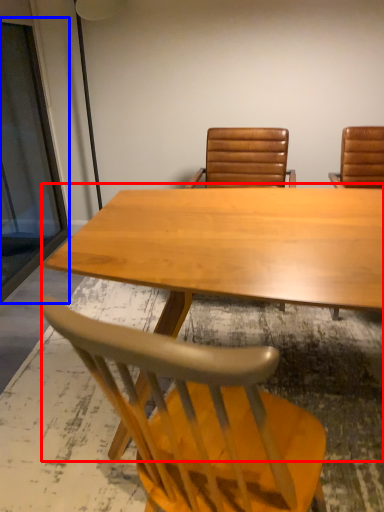
Question: Which point is closer to the camera, table (highlighted by a red box) or glass door (highlighted by a blue box)?

Choices:
 (A) table
 (B) glass door

Answer: (A)